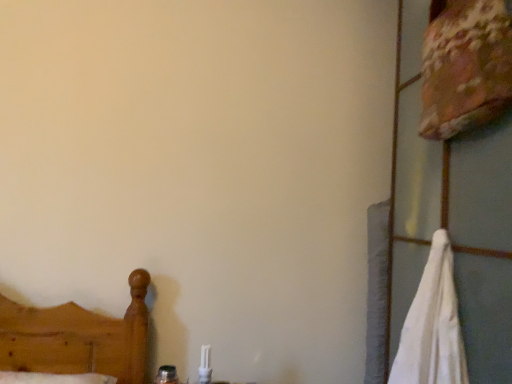
What do you see at coordinates (432, 326) in the screenshot?
I see `white cotton bath towel at right` at bounding box center [432, 326].

At what (x,y) coordinates should I click in order to perform the action: click on white cotton bath towel at right. Please return your answer as a coordinate pair (x, y). The width and height of the screenshot is (512, 384). Looking at the image, I should click on point(432,326).

This screenshot has height=384, width=512. What do you see at coordinates (466, 68) in the screenshot?
I see `floral fabric pillow at upper right` at bounding box center [466, 68].

Where is `floral fabric pillow at upper right`? floral fabric pillow at upper right is located at coordinates (466, 68).

Image resolution: width=512 pixels, height=384 pixels. I want to click on white cotton bath towel at right, so click(x=432, y=326).

Considering the relative positions of white cotton bath towel at right and floral fabric pillow at upper right in the image provided, is white cotton bath towel at right to the left or to the right of floral fabric pillow at upper right?

Clearly, white cotton bath towel at right is on the left of floral fabric pillow at upper right in the image.

Does white cotton bath towel at right lie behind floral fabric pillow at upper right?

No, white cotton bath towel at right is closer to the camera.

Is point (441, 292) positioned behind point (440, 49)?

Yes, point (441, 292) is behind point (440, 49).

From the image's perspective, which one is positioned higher, white cotton bath towel at right or floral fabric pillow at upper right?

From the image's view, floral fabric pillow at upper right is above.

From a real-world perspective, is white cotton bath towel at right below floral fabric pillow at upper right?

Indeed, from a real-world perspective, white cotton bath towel at right is positioned beneath floral fabric pillow at upper right.

Is white cotton bath towel at right thinner than floral fabric pillow at upper right?

In fact, white cotton bath towel at right might be wider than floral fabric pillow at upper right.

Which of these two, white cotton bath towel at right or floral fabric pillow at upper right, stands taller?

Standing taller between the two is white cotton bath towel at right.

Is white cotton bath towel at right bigger or smaller than floral fabric pillow at upper right?

Clearly, white cotton bath towel at right is larger in size than floral fabric pillow at upper right.

Is white cotton bath towel at right outside of floral fabric pillow at upper right?

Indeed, white cotton bath towel at right is completely outside floral fabric pillow at upper right.

Is white cotton bath towel at right positioned far away from floral fabric pillow at upper right?

Actually, white cotton bath towel at right and floral fabric pillow at upper right are a little close together.

Is white cotton bath towel at right facing towards floral fabric pillow at upper right?

No, white cotton bath towel at right is not turned towards floral fabric pillow at upper right.

What's the angular difference between white cotton bath towel at right and floral fabric pillow at upper right's facing directions?

They differ by 11.4 degrees in their facing directions.

In the image, there is a floral fabric pillow at upper right. Identify the location of bath towel below it (from the image's perspective). (432, 326).

Which is more to the left, floral fabric pillow at upper right or white cotton bath towel at right?

Positioned to the left is white cotton bath towel at right.

Is the depth of floral fabric pillow at upper right less than that of white cotton bath towel at right?

That is False.

Which is closer to the camera, (x=425, y=59) or (x=435, y=381)?

Point (x=425, y=59) is positioned farther from the camera compared to point (x=435, y=381).

From the image's perspective, which one is positioned higher, floral fabric pillow at upper right or white cotton bath towel at right?

floral fabric pillow at upper right is shown above in the image.

From a real-world perspective, does floral fabric pillow at upper right stand above white cotton bath towel at right?

Correct, in the physical world, floral fabric pillow at upper right is higher than white cotton bath towel at right.

Considering the relative sizes of floral fabric pillow at upper right and white cotton bath towel at right in the image provided, is floral fabric pillow at upper right wider than white cotton bath towel at right?

No, floral fabric pillow at upper right is not wider than white cotton bath towel at right.

From their relative heights in the image, would you say floral fabric pillow at upper right is taller or shorter than white cotton bath towel at right?

Clearly, floral fabric pillow at upper right is shorter compared to white cotton bath towel at right.

Which of these two, floral fabric pillow at upper right or white cotton bath towel at right, is smaller?

Smaller between the two is floral fabric pillow at upper right.

Which is correct: floral fabric pillow at upper right is inside white cotton bath towel at right, or outside of it?

floral fabric pillow at upper right lies outside white cotton bath towel at right.

Would you consider floral fabric pillow at upper right to be distant from white cotton bath towel at right?

No, floral fabric pillow at upper right is not far away from white cotton bath towel at right.

Consider the image. Is floral fabric pillow at upper right facing towards white cotton bath towel at right?

No, floral fabric pillow at upper right is not facing towards white cotton bath towel at right.

How many degrees apart are the facing directions of floral fabric pillow at upper right and white cotton bath towel at right?

The facing directions of floral fabric pillow at upper right and white cotton bath towel at right are 11.4 degrees apart.

This screenshot has width=512, height=384. I want to click on bath towel located below the floral fabric pillow at upper right (from the image's perspective), so click(432, 326).

This screenshot has width=512, height=384. Identify the location of bath towel located below the floral fabric pillow at upper right (from the image's perspective). (432, 326).

Identify the location of bath towel on the left of floral fabric pillow at upper right. (432, 326).